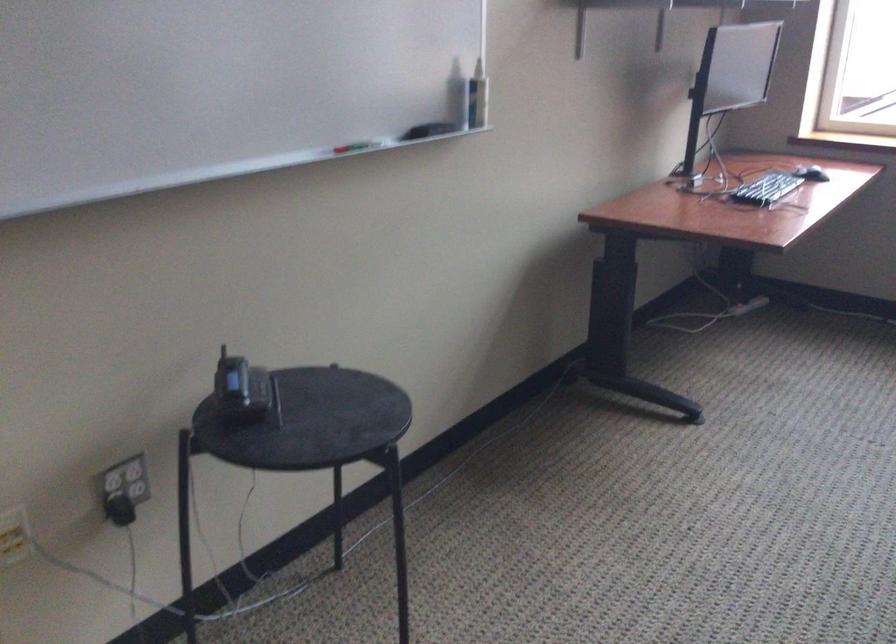
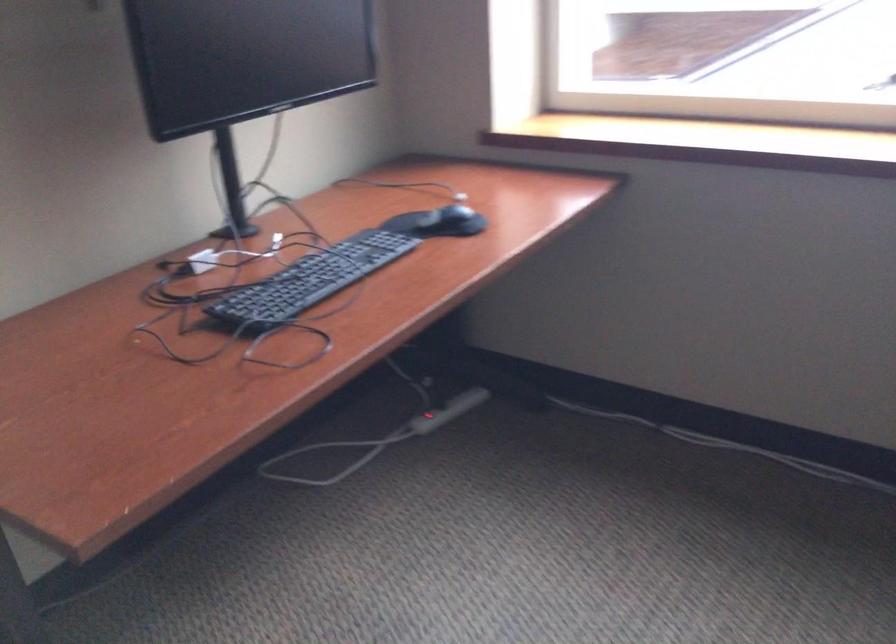
In the second image, find the point that corresponds to [755,296] in the first image.

(428, 421)